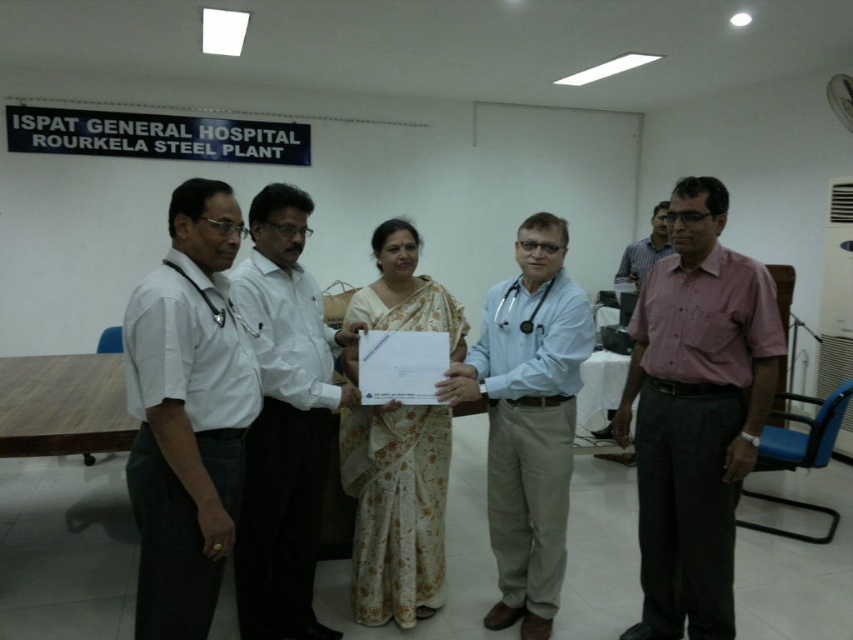
Question: Estimate the real-world distances between objects in this image. Which object is farther from the white shirt at left?

Choices:
 (A) white shirt at center
 (B) light blue shirt at center
 (C) white floral saree at center
 (D) pink cotton shirt at center

Answer: (D)

Question: Can you confirm if white shirt at left is thinner than light blue shirt at center?

Choices:
 (A) yes
 (B) no

Answer: (A)

Question: Which of these objects is positioned farthest from the white floral saree at center?

Choices:
 (A) pink cotton shirt at center
 (B) white shirt at left

Answer: (B)

Question: Which object is closer to the camera taking this photo?

Choices:
 (A) light blue shirt at center
 (B) white shirt at center
 (C) pink cotton shirt at center

Answer: (B)

Question: Is pink cotton shirt at center to the right of white floral saree at center from the viewer's perspective?

Choices:
 (A) yes
 (B) no

Answer: (A)

Question: Does white shirt at center appear under light blue shirt at center?

Choices:
 (A) yes
 (B) no

Answer: (B)